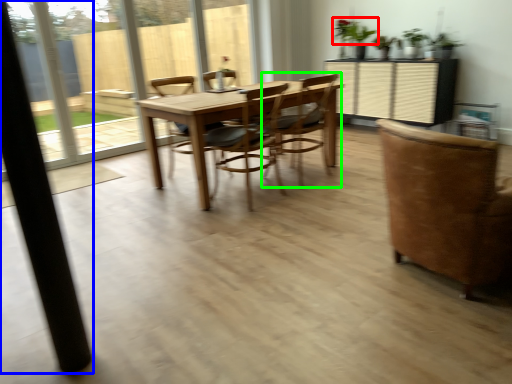
Question: Estimate the real-world distances between objects in this image. Which object is farther from plant (highlighted by a red box), pillar (highlighted by a blue box) or chair (highlighted by a green box)?

Choices:
 (A) pillar
 (B) chair

Answer: (A)